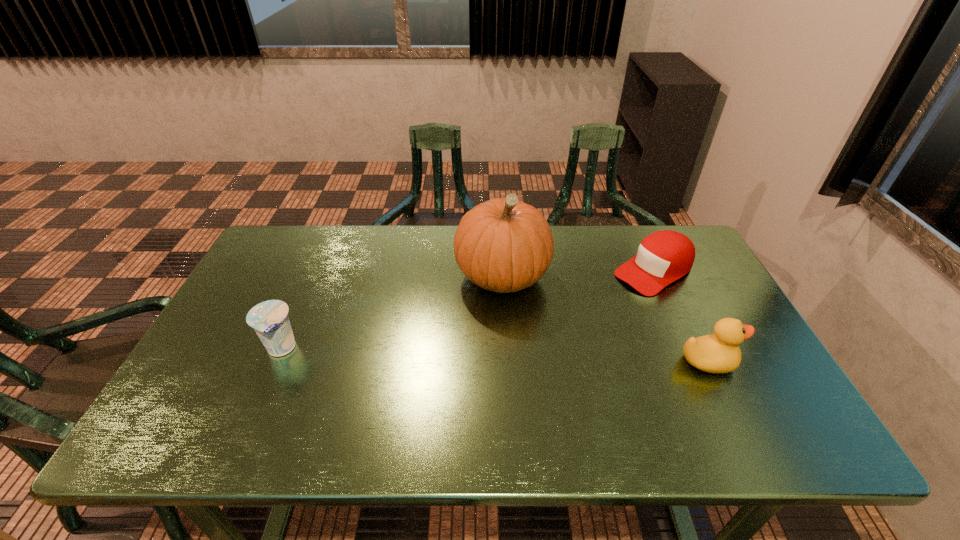
This screenshot has width=960, height=540. Find the location of `unoccupied area between the leftmost object and the third shortest object`. unoccupied area between the leftmost object and the third shortest object is located at coordinates (494, 355).

Image resolution: width=960 pixels, height=540 pixels. I want to click on blank region between the yogurt and the baseball cap, so pos(468,310).

Find the location of a particular element. The image size is (960, 540). unoccupied area between the baseball cap and the third object from right to left is located at coordinates (578, 274).

Image resolution: width=960 pixels, height=540 pixels. I want to click on object that can be found as the second closest to the duck, so click(504, 245).

Find the location of a particular element. object that is the second closest one to the duck is located at coordinates (504, 245).

I want to click on vacant space that satisfies the following two spatial constraints: 1. on the front side of the third shortest object; 2. at the beak of the yogurt, so click(276, 361).

Where is `vacant region that satisfies the following two spatial constraints: 1. on the front side of the second tallest object; 2. at the beak of the second object from left to right`? The height and width of the screenshot is (540, 960). vacant region that satisfies the following two spatial constraints: 1. on the front side of the second tallest object; 2. at the beak of the second object from left to right is located at coordinates (507, 361).

Image resolution: width=960 pixels, height=540 pixels. What are the coordinates of `vacant region that satisfies the following two spatial constraints: 1. on the back side of the tallest object; 2. on the left side of the yogurt` in the screenshot? It's located at (313, 276).

Identify the location of vacant area that satisfies the following two spatial constraints: 1. on the front side of the baseball cap; 2. at the beak of the second tallest object. The image size is (960, 540). (696, 361).